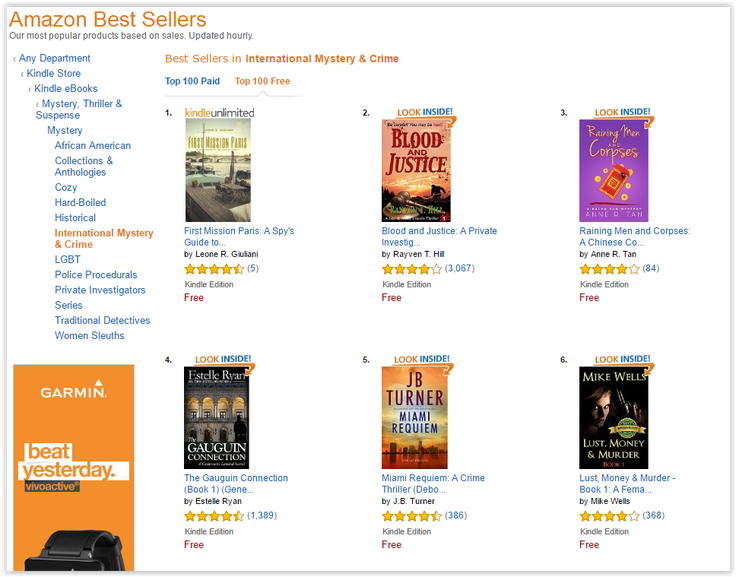
The image size is (736, 577). Identify the location of books. (224, 421), (219, 194), (402, 155), (414, 388), (609, 185), (601, 426).